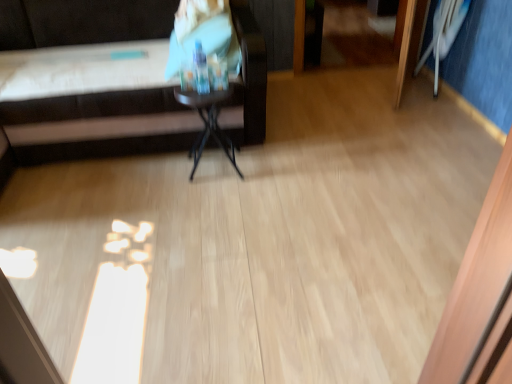
In order to click on free space to the left of black glossy side table at center in this screenshot , I will do `click(166, 175)`.